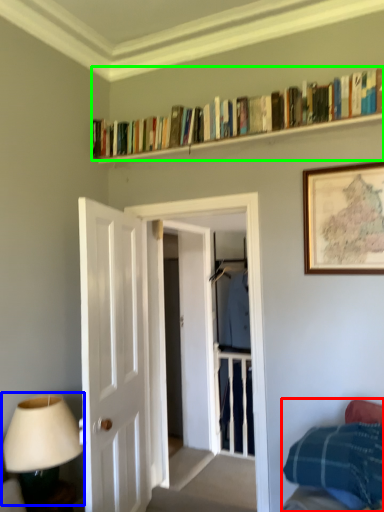
Question: Which object is positioned farthest from bed (highlighted by a red box)? Select from table lamp (highlighted by a blue box) and book (highlighted by a green box).

Choices:
 (A) table lamp
 (B) book

Answer: (B)